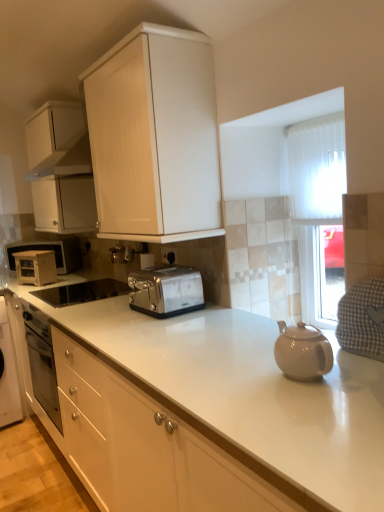
Question: From their relative heights in the image, would you say white glossy cabinet at upper center, which is the second cabinetry in left-to-right order, is taller or shorter than gray checkered cloth at right?

Choices:
 (A) tall
 (B) short

Answer: (A)

Question: Considering the positions of white glossy cabinet at upper center, acting as the first cabinetry starting from the right, and gray checkered cloth at right in the image, is white glossy cabinet at upper center, acting as the first cabinetry starting from the right, bigger or smaller than gray checkered cloth at right?

Choices:
 (A) small
 (B) big

Answer: (B)

Question: Which object is positioned closest to the satin silver toaster at center?

Choices:
 (A) satin silver toaster at center, acting as the 3th appliance starting from the back
 (B) gray checkered cloth at right
 (C) satin silver toaster at left, which ranks as the second appliance in back-to-front order
 (D) white glossy cabinet at upper center, acting as the first cabinetry starting from the right
 (E) white matte microwave at left, which appears as the third appliance when viewed from the front

Answer: (D)

Question: Which object is positioned closest to the white glossy cabinet at upper center, positioned as the 1th cabinetry in front-to-back order?

Choices:
 (A) white matte microwave at left, which appears as the third appliance when viewed from the front
 (B) white matte cabinet at upper left, which is the 1th cabinetry from left to right
 (C) satin silver toaster at center, acting as the 3th appliance starting from the back
 (D) satin silver toaster at left, which ranks as the second appliance in back-to-front order
 (E) gray checkered cloth at right

Answer: (B)